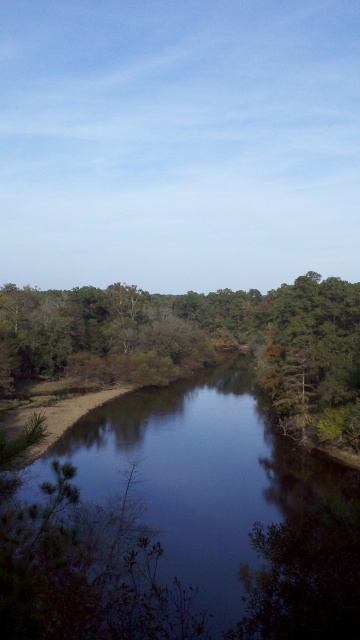
You are a photographer standing at the edge of the river. You want to capture a photo where the green leafy tree at center is reflected in the dark reflective water at center. Is the position of the tree above the water such that its reflection would be visible in the water?

The dark reflective water at center is below the green leafy tree at center, so the tree is positioned above the water. Since the water is reflective, the reflection of the green leafy tree at center should be visible in the dark reflective water at center.